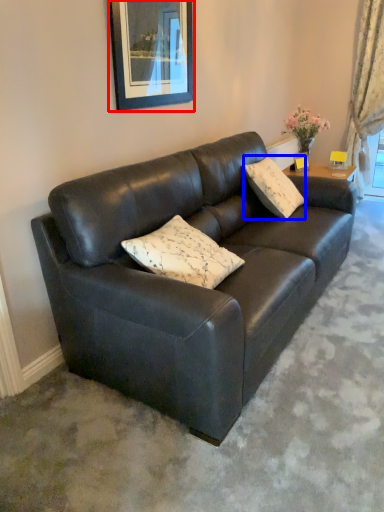
Question: Which point is closer to the camera, picture frame (highlighted by a red box) or pillow (highlighted by a blue box)?

Choices:
 (A) picture frame
 (B) pillow

Answer: (A)